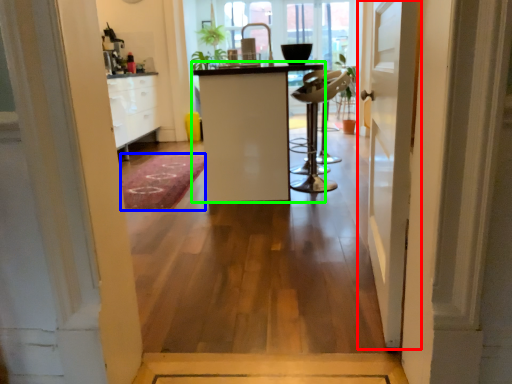
Question: Considering the real-world distances, which object is farthest from door (highlighted by a red box)? doormat (highlighted by a blue box) or furniture (highlighted by a green box)?

Choices:
 (A) doormat
 (B) furniture

Answer: (A)